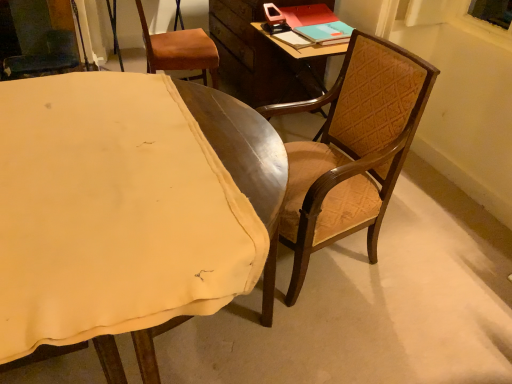
The image size is (512, 384). Identify the location of vacant area to the right of wooden chair at center, positioned as the second chair in front-to-back order. (416, 268).